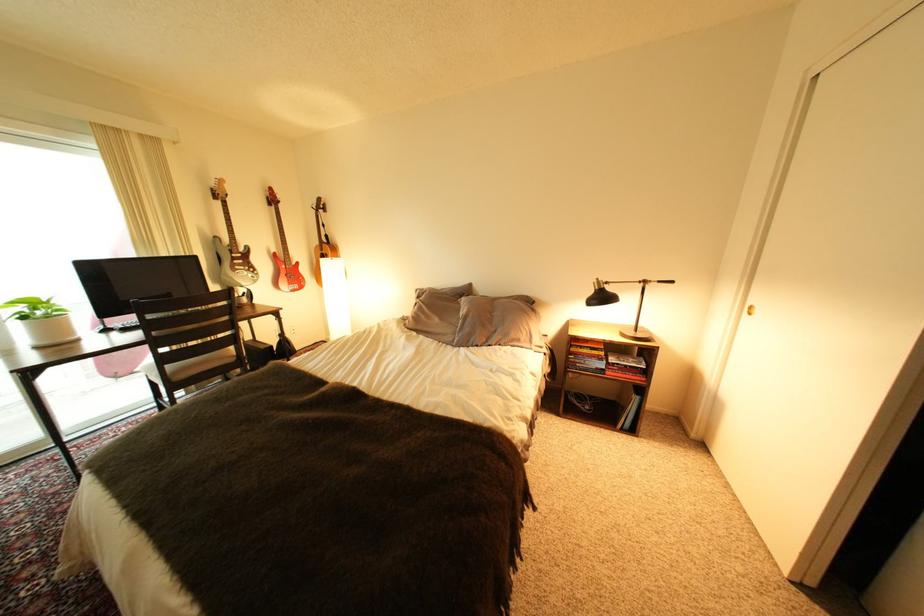
In order to click on chair sitting surface in this screenshot , I will do `click(188, 365)`.